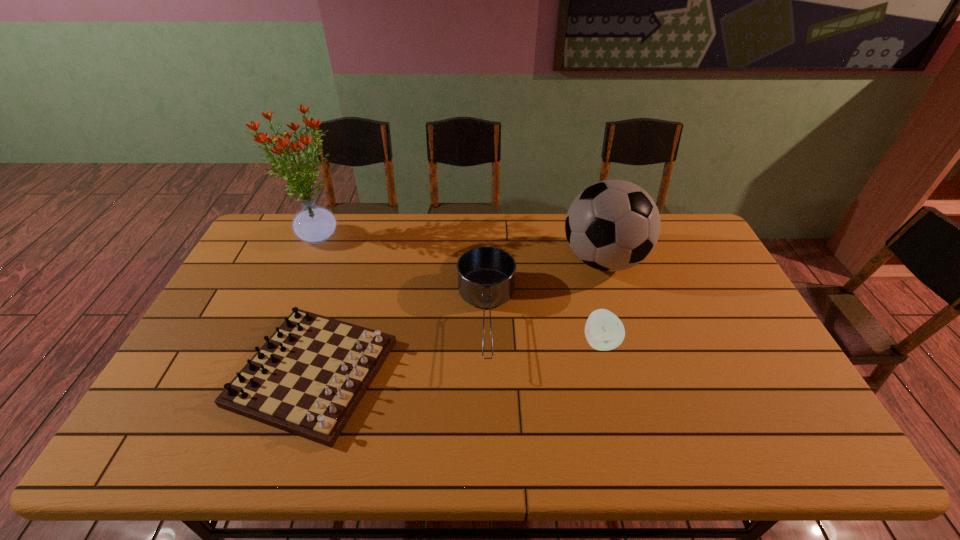
Where is `vacant area that lies between the third object from left to right and the shortest object`? This screenshot has height=540, width=960. vacant area that lies between the third object from left to right and the shortest object is located at coordinates (399, 345).

Where is `free space that is in between the chessboard and the tallest object`? This screenshot has width=960, height=540. free space that is in between the chessboard and the tallest object is located at coordinates (317, 303).

Identify the location of vacant area that lies between the third object from left to right and the chessboard. The image size is (960, 540). (399, 345).

Select which object is the third closest to the chessboard. Please provide its 2D coordinates. Your answer should be formatted as a tuple, i.e. [(x, y)], where the tuple contains the x and y coordinates of a point satisfying the conditions above.

[(612, 225)]

Point out which object is positioned as the second nearest to the tallest object. Please provide its 2D coordinates. Your answer should be formatted as a tuple, i.e. [(x, y)], where the tuple contains the x and y coordinates of a point satisfying the conditions above.

[(486, 275)]

What are the coordinates of `vacant region that satisfies the following two spatial constraints: 1. on the front side of the chessboard; 2. on the right side of the tallest object` in the screenshot? It's located at (261, 373).

Where is `free location that satisfies the following two spatial constraints: 1. on the front side of the flower arrangement; 2. on the right side of the fourth shortest object`? free location that satisfies the following two spatial constraints: 1. on the front side of the flower arrangement; 2. on the right side of the fourth shortest object is located at coordinates (310, 260).